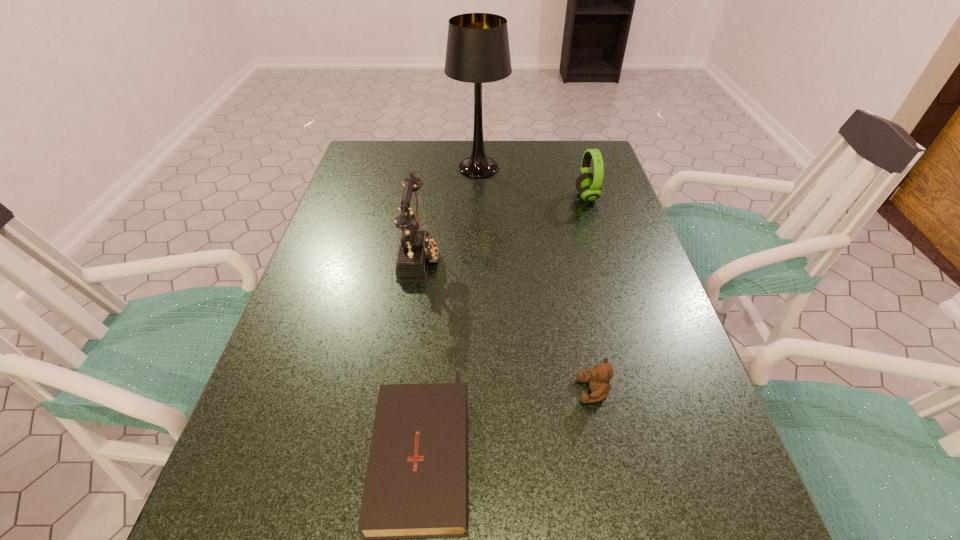
Locate an element on the screen. The image size is (960, 540). the tallest object is located at coordinates (477, 51).

At what (x,y) coordinates should I click in order to perform the action: click on the farthest object. Please return your answer as a coordinate pair (x, y). The width and height of the screenshot is (960, 540). Looking at the image, I should click on (477, 51).

In order to click on the third nearest object in this screenshot , I will do `click(417, 248)`.

The width and height of the screenshot is (960, 540). Identify the location of telephone. (417, 248).

At what (x,y) coordinates should I click in order to perform the action: click on headset. Please return your answer as a coordinate pair (x, y). Image resolution: width=960 pixels, height=540 pixels. Looking at the image, I should click on (588, 185).

In order to click on the rightmost object in this screenshot , I will do `click(588, 185)`.

Where is `the second object from right to left`? the second object from right to left is located at coordinates (598, 379).

What are the coordinates of `the fourth tallest object` in the screenshot? It's located at (598, 379).

Where is `free location located on the right of the farthest object`? free location located on the right of the farthest object is located at coordinates (573, 167).

The image size is (960, 540). In order to click on blank space located 0.300m on the dial of the fourth shortest object in this screenshot , I will do `click(559, 256)`.